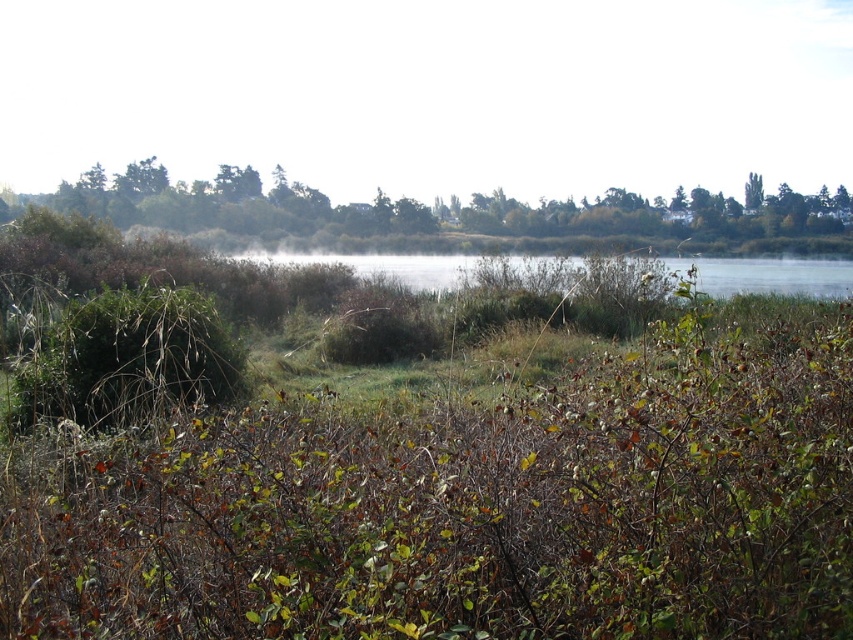
Where is `foggy mist at upper center`? This screenshot has height=640, width=853. foggy mist at upper center is located at coordinates (432, 93).

Which is above, foggy mist at upper center or green leafy tree at upper right?

foggy mist at upper center is higher up.

Is point (834, 61) closer to camera compared to point (753, 209)?

No, it is behind (753, 209).

I want to click on foggy mist at upper center, so click(x=432, y=93).

Is point (90, 35) positioned in front of point (727, 280)?

No, (90, 35) is further to viewer.

Locate an element on the screen. This screenshot has height=640, width=853. foggy mist at upper center is located at coordinates (432, 93).

The image size is (853, 640). I want to click on foggy mist at upper center, so click(432, 93).

Looking at this image, between brown dry grass at center and foggy mist at upper center, which one has more height?

With more height is foggy mist at upper center.

Measure the distance between brown dry grass at center and camera.

brown dry grass at center is 7.52 feet from camera.

Is point (78, 544) positioned after point (663, 129)?

No, (78, 544) is in front of (663, 129).

The image size is (853, 640). What are the coordinates of `brown dry grass at center` in the screenshot? It's located at (465, 508).